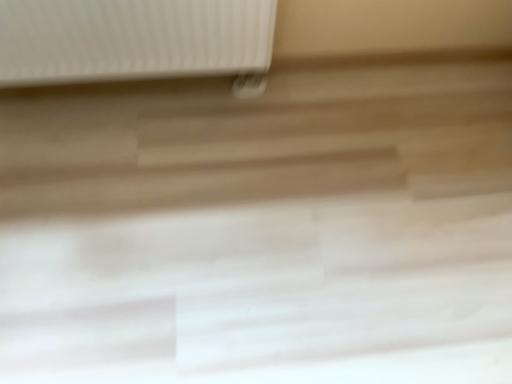
The image size is (512, 384). In order to click on vacant space to the right of white ribbed radiator at upper left in this screenshot , I will do `click(267, 127)`.